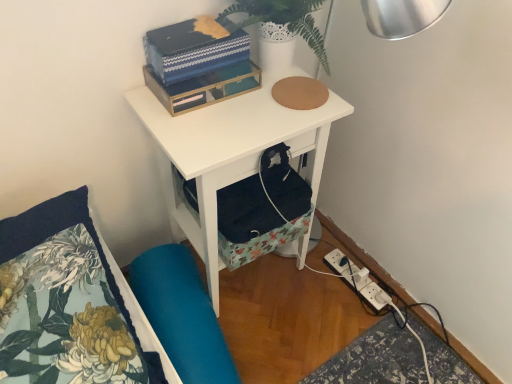
At what (x,y) coordinates should I click in order to perform the action: click on free point to the left of white plastic power strip at lower right. Please return your answer as a coordinate pair (x, y). The image size is (512, 384). Looking at the image, I should click on (311, 286).